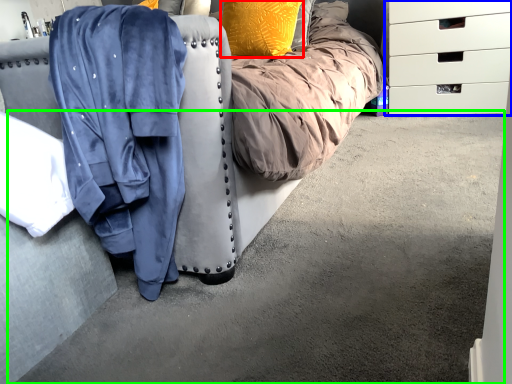
Question: Estimate the real-world distances between objects in this image. Which object is farther from pillow (highlighted by a red box), chest of drawers (highlighted by a blue box) or concrete (highlighted by a green box)?

Choices:
 (A) chest of drawers
 (B) concrete

Answer: (B)